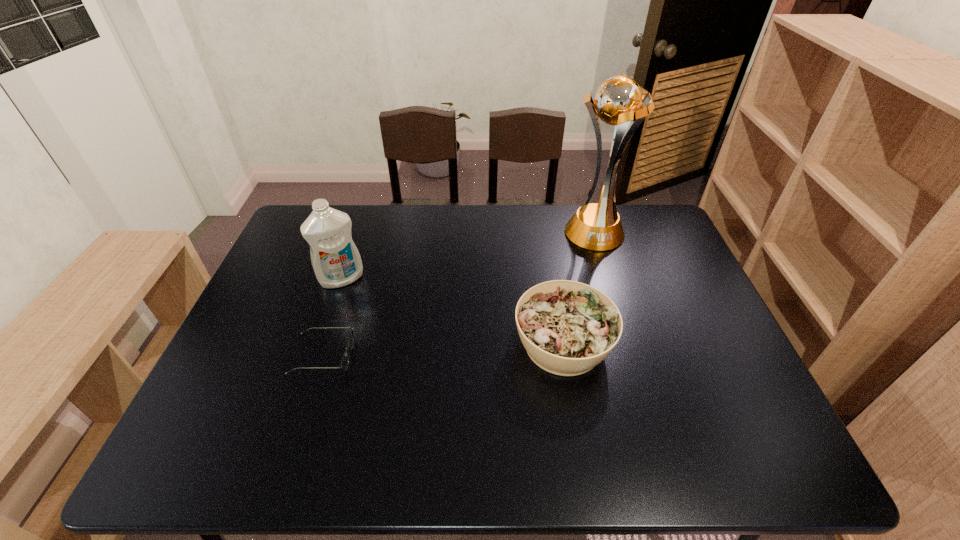
This screenshot has height=540, width=960. In order to click on object that is positioned at the far edge in this screenshot , I will do `click(620, 101)`.

At what (x,y) coordinates should I click in order to perform the action: click on object that is at the left edge. Please return your answer as a coordinate pair (x, y). This screenshot has height=540, width=960. Looking at the image, I should click on (336, 261).

Image resolution: width=960 pixels, height=540 pixels. Find the location of `object located in the right edge section of the desktop`. object located in the right edge section of the desktop is located at coordinates click(x=620, y=101).

Identify the location of object present at the far right corner. (620, 101).

I want to click on vacant space at the far edge, so click(550, 208).

Where is `vacant space at the near edge of the desktop`? This screenshot has height=540, width=960. vacant space at the near edge of the desktop is located at coordinates (386, 430).

At what (x,y) coordinates should I click in order to perform the action: click on free space at the left edge. Please return your answer as a coordinate pair (x, y). This screenshot has height=540, width=960. Looking at the image, I should click on [300, 264].

Identify the location of vacant region at the right edge of the desktop. (678, 293).

The image size is (960, 540). I want to click on vacant space in between the second farthest object and the tallest object, so click(x=468, y=255).

Locate an element on the screen. The image size is (960, 540). free spot between the shortest object and the salad is located at coordinates (444, 350).